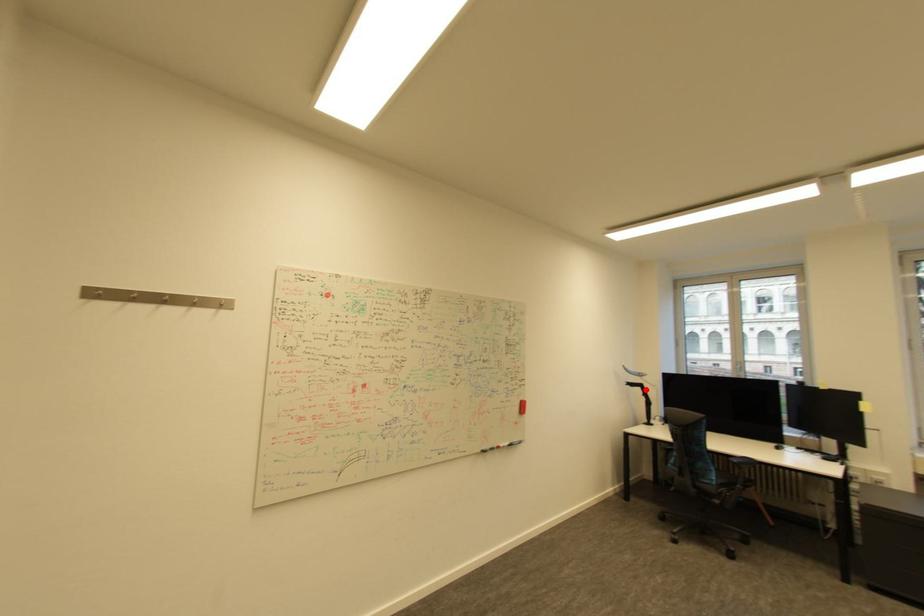
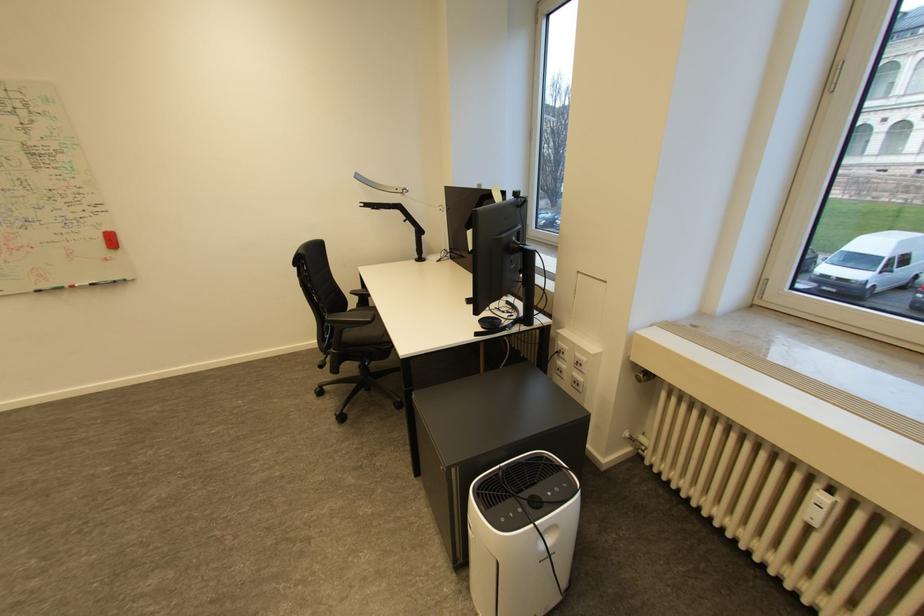
Locate, in the second image, the point that corresponds to the highlighted location in the first image.

(405, 213)